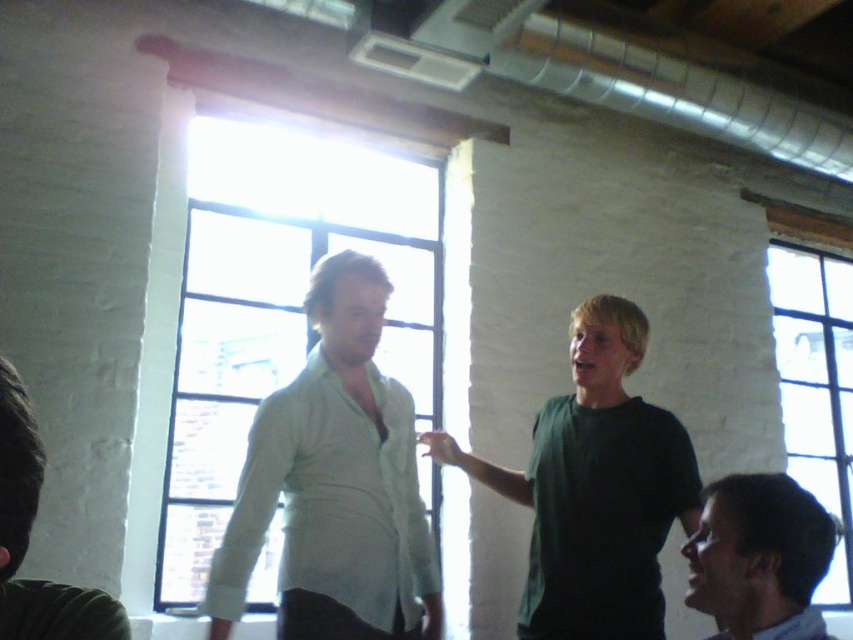
Question: From the image, what is the correct spatial relationship of dark green shirt at lower right in relation to dark green shirt at left?

Choices:
 (A) right
 (B) left

Answer: (A)

Question: Is light green fabric shirt at center closer to the viewer compared to green matte shirt at center?

Choices:
 (A) yes
 (B) no

Answer: (A)

Question: Which point is farther to the camera?

Choices:
 (A) dark green shirt at left
 (B) dark green shirt at lower right
 (C) light green fabric shirt at center

Answer: (C)

Question: Among these points, which one is nearest to the camera?

Choices:
 (A) (380, 296)
 (B) (653, 634)

Answer: (A)

Question: Which point is farther from the camera taking this photo?

Choices:
 (A) (339, 275)
 (B) (839, 301)

Answer: (B)

Question: Does clear glass window at upper right appear over dark green shirt at lower right?

Choices:
 (A) no
 (B) yes

Answer: (A)